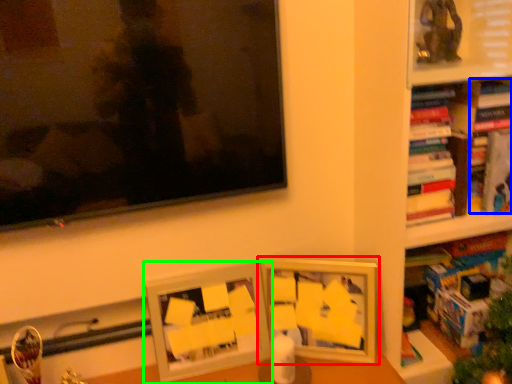
Question: Which object is the closest to the picture frame (highlighted by a red box)? Choose among these: book (highlighted by a blue box) or picture frame (highlighted by a green box).

Choices:
 (A) book
 (B) picture frame

Answer: (B)